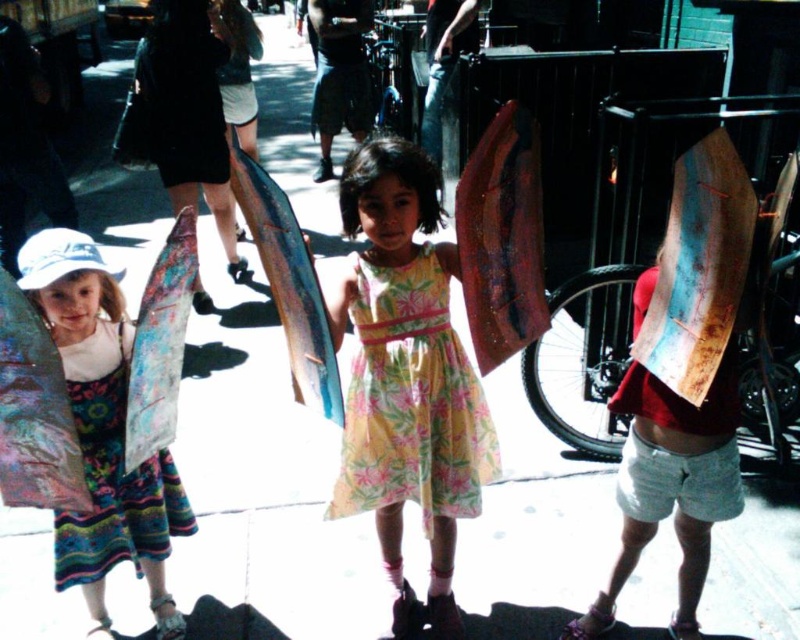
Question: Can you confirm if shiny metallic surfboard at center is wider than floral fabric surfboard at left?

Choices:
 (A) no
 (B) yes

Answer: (A)

Question: Is wooden surfboard at right above shiny blue surfboard at center?

Choices:
 (A) no
 (B) yes

Answer: (B)

Question: Which point is farther to the camera?

Choices:
 (A) pos(252,177)
 (B) pos(704,401)

Answer: (B)

Question: Which point appears farthest from the camera in this image?

Choices:
 (A) (649, 477)
 (B) (694, 324)
 (C) (122, 369)
 (D) (14, 316)

Answer: (C)

Question: Which point is farther to the camera?

Choices:
 (A) wooden surfboard at right
 (B) shiny metallic surfboard at left
 (C) floral fabric surfboard at left

Answer: (C)

Question: Can you confirm if floral cotton dress at center is positioned below shiny blue surfboard at center?

Choices:
 (A) no
 (B) yes

Answer: (B)